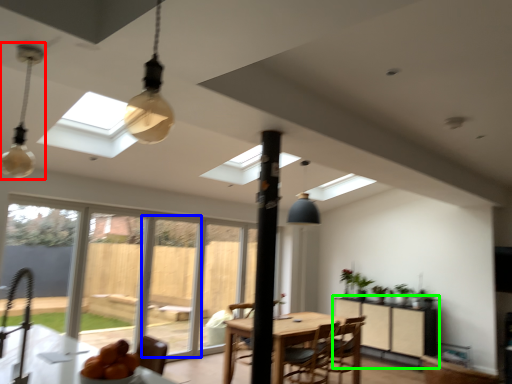
Question: Considering the real-world distances, which object is farthest from lamp (highlighted by a red box)? screen door (highlighted by a blue box) or cabinetry (highlighted by a green box)?

Choices:
 (A) screen door
 (B) cabinetry

Answer: (B)